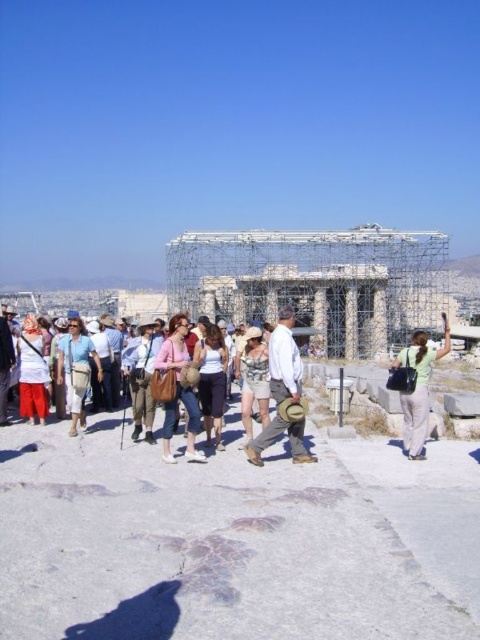
You are a tour guide standing at the entrance of the archaeological site. You notice a tourist carrying a green fabric bag at center. If you want to point out the location of the bag to another guide who is approaching from the north, how would you describe its position relative to the central building?

The green fabric bag at center is located at coordinates approximately 0.606 along the x axis and 0.871 along the y axis relative to the central building.

You are standing at the archaeological site and want to locate the green fabric bag at center. Based on the coordinates provided, which object in the scene is located at point (418, 387)?

The point (418, 387) corresponds to the green fabric bag at center.